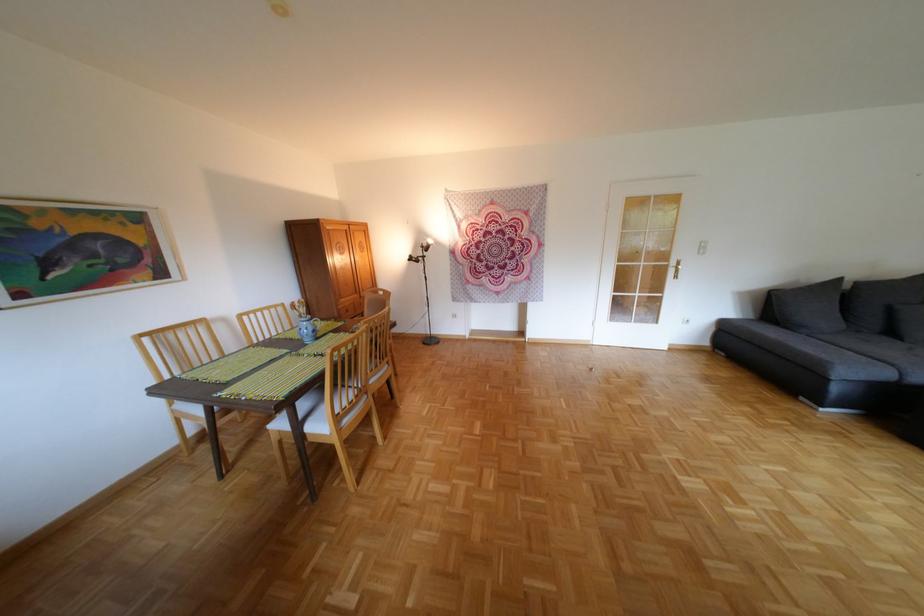
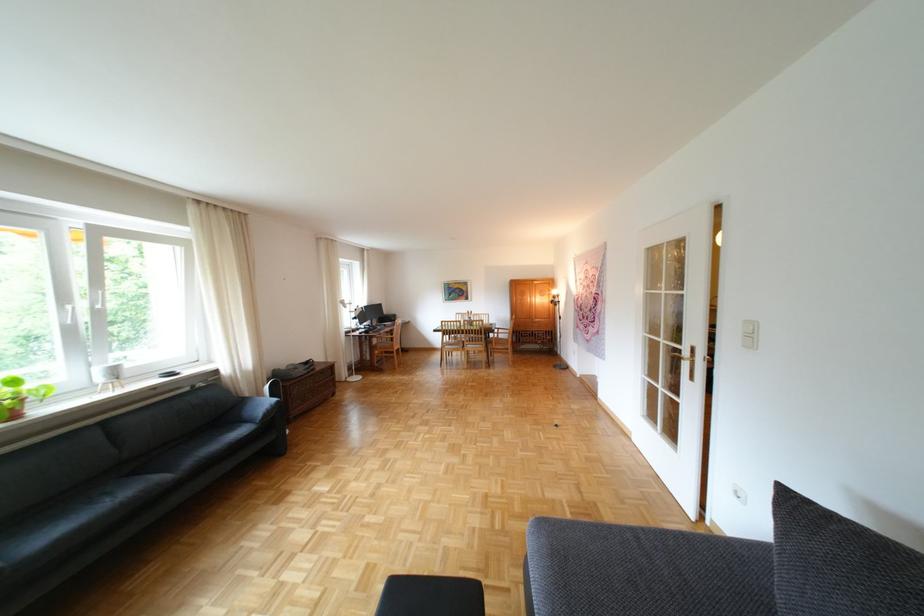
Where in the second image is the point corresponding to point (361, 225) from the first image?

(544, 281)